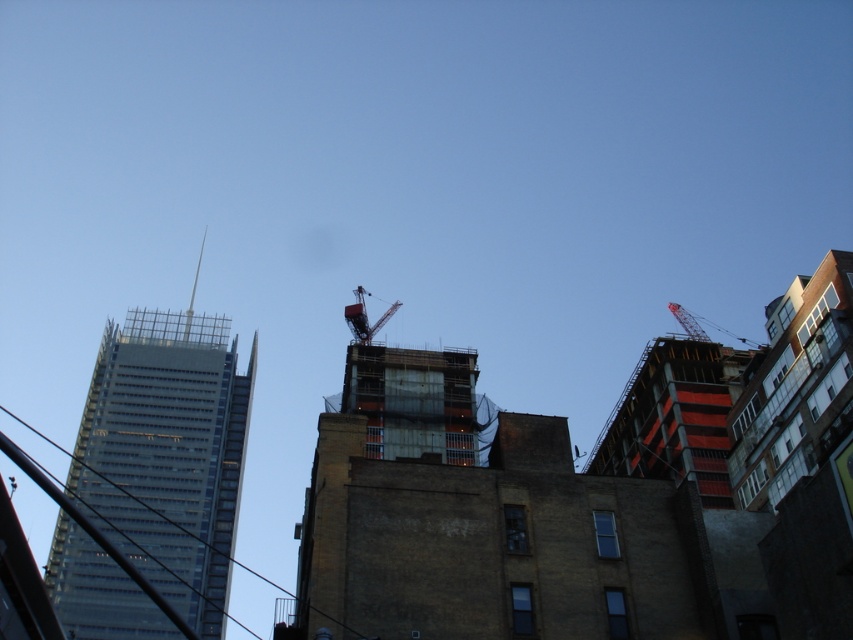
Which of these two, transparent glass skyscraper at upper left or metallic red crane at center, stands taller?

With more height is transparent glass skyscraper at upper left.

Describe the element at coordinates (167, 452) in the screenshot. I see `transparent glass skyscraper at upper left` at that location.

Identify the location of transparent glass skyscraper at upper left. The height and width of the screenshot is (640, 853). (167, 452).

Is transparent glass skyscraper at upper left below metallic red crane at upper right?

Yes.

Describe the element at coordinates (167, 452) in the screenshot. I see `transparent glass skyscraper at upper left` at that location.

You are a GUI agent. You are given a task and a screenshot of the screen. Output one action in this format:
    pyautogui.click(x=<x>, y=<y>)
    Task: Click on the transparent glass skyscraper at upper left
    The image size is (853, 640).
    Given the screenshot: What is the action you would take?
    pyautogui.click(x=167, y=452)

Between point (347, 323) and point (706, 339), which one is positioned in front?

Point (706, 339)

Between point (364, 314) and point (692, 333), which one is positioned behind?

The point (364, 314) is more distant.

Is point (354, 321) in front of point (753, 342)?

No, (354, 321) is behind (753, 342).

Locate an element on the screen. metallic red crane at center is located at coordinates (364, 316).